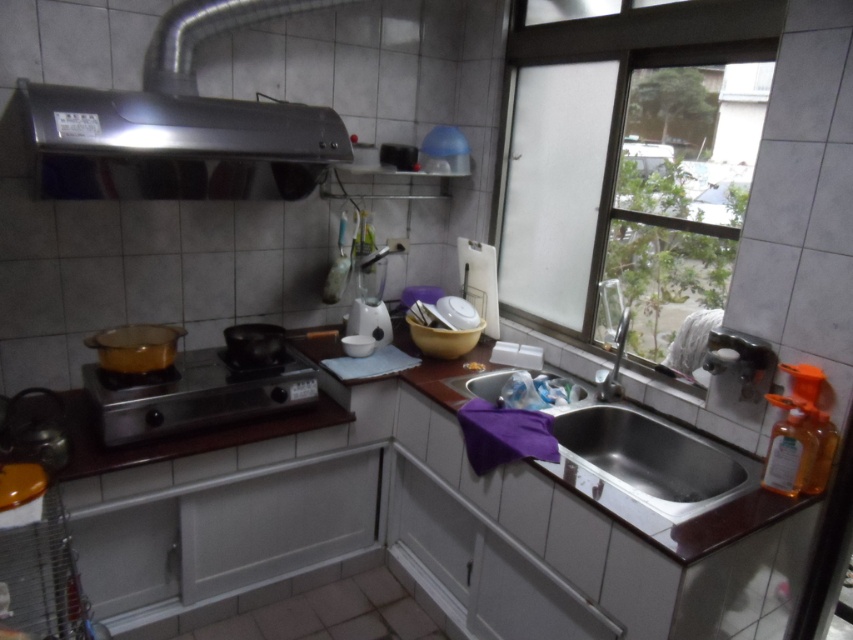
Locate an element on the screen. The height and width of the screenshot is (640, 853). transparent glass window at upper right is located at coordinates (637, 168).

Does transparent glass window at upper right have a larger size compared to stainless steel sink at lower center?

Yes, transparent glass window at upper right is bigger than stainless steel sink at lower center.

Is point (697, 104) positioned behind point (733, 497)?

Yes, it is.

I want to click on transparent glass window at upper right, so click(637, 168).

Is stainless steel sink at lower center positioned in front of metallic stove at lower left?

Yes, stainless steel sink at lower center is in front of metallic stove at lower left.

Can you confirm if stainless steel sink at lower center is positioned below metallic stove at lower left?

Correct, stainless steel sink at lower center is located below metallic stove at lower left.

Where is `stainless steel sink at lower center`? The image size is (853, 640). stainless steel sink at lower center is located at coordinates (645, 464).

Between point (634, 444) and point (606, 387), which one is positioned behind?

Positioned behind is point (606, 387).

Is stainless steel sink at lower center shorter than satin nickel faucet at sink right?

Yes, stainless steel sink at lower center is shorter than satin nickel faucet at sink right.

Who is more forward, (708, 506) or (602, 396)?

Point (708, 506) is in front.

This screenshot has height=640, width=853. I want to click on stainless steel sink at lower center, so click(x=645, y=464).